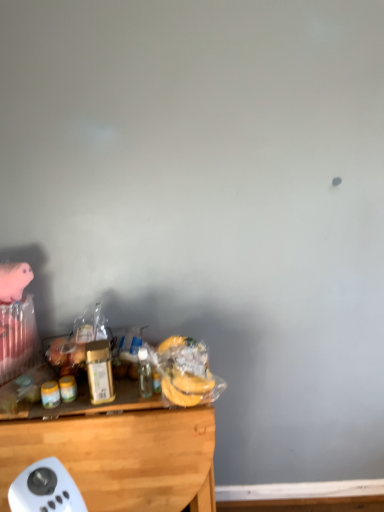
Locate an element on the screen. The height and width of the screenshot is (512, 384). vacant space to the left of translucent plastic bananas at lower center, arranged as the second food when viewed from the left is located at coordinates (135, 398).